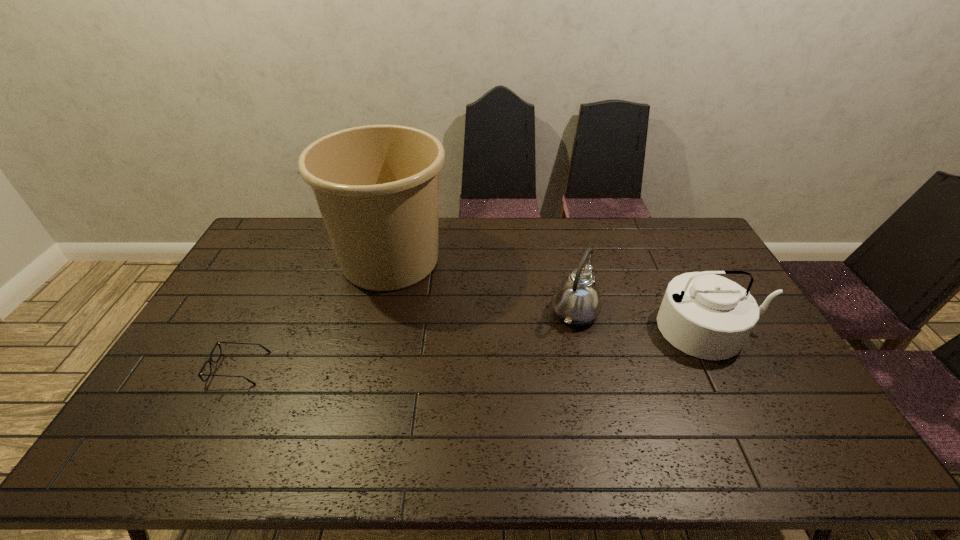
Locate an element on the screen. This screenshot has width=960, height=540. object present at the far edge is located at coordinates (377, 186).

This screenshot has height=540, width=960. What are the coordinates of `object that is at the left edge` in the screenshot? It's located at (210, 360).

The width and height of the screenshot is (960, 540). Find the location of `object located at the right edge`. object located at the right edge is located at coordinates (707, 316).

The width and height of the screenshot is (960, 540). In the image, there is a desktop. What are the coordinates of `free region at the far edge` in the screenshot? It's located at (616, 238).

Find the location of a particular element. The height and width of the screenshot is (540, 960). free space at the near edge of the desktop is located at coordinates (441, 440).

In the image, there is a desktop. Where is `free space at the left edge`? The image size is (960, 540). free space at the left edge is located at coordinates (256, 280).

Identify the location of vacant space at the right edge of the desktop. (764, 346).

Locate an element on the screen. free space at the far left corner of the desktop is located at coordinates (276, 221).

Where is `vacant space at the far right corner of the desktop`? The height and width of the screenshot is (540, 960). vacant space at the far right corner of the desktop is located at coordinates point(677,226).

Locate an element on the screen. This screenshot has width=960, height=540. vacant area that lies between the right kettle and the spectacles is located at coordinates tap(474, 348).